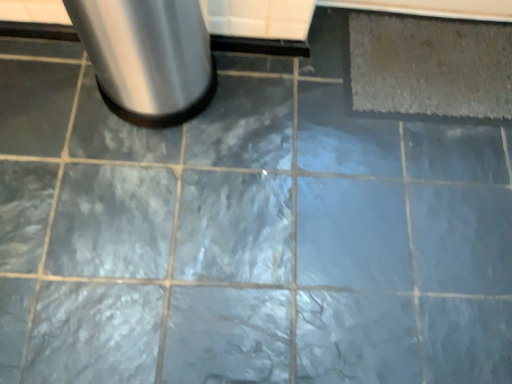
Measure the distance between point (482, 34) and camera.

They are 4.57 feet apart.

What is the approximate height of gray textured mat at upper right?

It is 2.12 centimeters.

Locate an element on the screen. gray textured mat at upper right is located at coordinates (430, 66).

This screenshot has width=512, height=384. What do you see at coordinates (430, 66) in the screenshot? I see `gray textured mat at upper right` at bounding box center [430, 66].

The height and width of the screenshot is (384, 512). What are the coordinates of `brushed metal trash can at upper left` in the screenshot? It's located at (148, 57).

What do you see at coordinates (148, 57) in the screenshot? The width and height of the screenshot is (512, 384). I see `brushed metal trash can at upper left` at bounding box center [148, 57].

Where is `gray textured mat at upper right`? The height and width of the screenshot is (384, 512). gray textured mat at upper right is located at coordinates [x=430, y=66].

Between brushed metal trash can at upper left and gray textured mat at upper right, which one appears on the right side from the viewer's perspective?

Positioned to the right is gray textured mat at upper right.

Is brushed metal trash can at upper left positioned in front of gray textured mat at upper right?

Yes, the depth of brushed metal trash can at upper left is less than that of gray textured mat at upper right.

Considering the positions of point (126, 111) and point (445, 63), is point (126, 111) closer or farther from the camera than point (445, 63)?

Point (126, 111) appears to be closer to the viewer than point (445, 63).

From the image's perspective, is brushed metal trash can at upper left over gray textured mat at upper right?

Actually, brushed metal trash can at upper left appears below gray textured mat at upper right in the image.

From a real-world perspective, which is physically above, brushed metal trash can at upper left or gray textured mat at upper right?

brushed metal trash can at upper left, from a real-world perspective.

Is brushed metal trash can at upper left thinner than gray textured mat at upper right?

Yes, brushed metal trash can at upper left is thinner than gray textured mat at upper right.

Does brushed metal trash can at upper left have a lesser height compared to gray textured mat at upper right?

In fact, brushed metal trash can at upper left may be taller than gray textured mat at upper right.

Which of these two, brushed metal trash can at upper left or gray textured mat at upper right, is smaller?

With smaller size is gray textured mat at upper right.

Would you say gray textured mat at upper right is part of brushed metal trash can at upper left's contents?

No, gray textured mat at upper right is not inside brushed metal trash can at upper left.

Is brushed metal trash can at upper left far away from gray textured mat at upper right?

No, there isn't a large distance between brushed metal trash can at upper left and gray textured mat at upper right.

Could you tell me if brushed metal trash can at upper left is turned towards gray textured mat at upper right?

No, brushed metal trash can at upper left is not aimed at gray textured mat at upper right.

Measure the distance from brushed metal trash can at upper left to gray textured mat at upper right.

They are 25.21 inches apart.

The width and height of the screenshot is (512, 384). In order to click on waste container located in front of the gray textured mat at upper right in this screenshot , I will do `click(148, 57)`.

Between gray textured mat at upper right and brushed metal trash can at upper left, which one appears on the right side from the viewer's perspective?

gray textured mat at upper right is more to the right.

Looking at this image, considering their positions, is gray textured mat at upper right located in front of or behind brushed metal trash can at upper left?

gray textured mat at upper right is behind brushed metal trash can at upper left.

Is point (463, 82) closer to camera compared to point (184, 1)?

No.

From the image's perspective, is gray textured mat at upper right located above or below brushed metal trash can at upper left?

gray textured mat at upper right is above brushed metal trash can at upper left.

From a real-world perspective, between gray textured mat at upper right and brushed metal trash can at upper left, who is vertically lower?

In real-world perspective, gray textured mat at upper right is lower.

Which object is wider, gray textured mat at upper right or brushed metal trash can at upper left?

gray textured mat at upper right is wider.

Does gray textured mat at upper right have a lesser height compared to brushed metal trash can at upper left?

Correct, gray textured mat at upper right is not as tall as brushed metal trash can at upper left.

Is gray textured mat at upper right bigger than brushed metal trash can at upper left?

No, gray textured mat at upper right is not bigger than brushed metal trash can at upper left.

Is gray textured mat at upper right positioned beyond the bounds of brushed metal trash can at upper left?

Yes, gray textured mat at upper right is located beyond the bounds of brushed metal trash can at upper left.

Is gray textured mat at upper right placed right next to brushed metal trash can at upper left?

No, gray textured mat at upper right is not touching brushed metal trash can at upper left.

Is brushed metal trash can at upper left at the back of gray textured mat at upper right?

No, brushed metal trash can at upper left is not at the back of gray textured mat at upper right.

Measure the distance between gray textured mat at upper right and brushed metal trash can at upper left.

gray textured mat at upper right and brushed metal trash can at upper left are 64.04 centimeters apart.

Locate an element on the screen. This screenshot has height=384, width=512. waste container that appears in front of the gray textured mat at upper right is located at coordinates (148, 57).

I want to click on mat above the brushed metal trash can at upper left (from the image's perspective), so click(430, 66).

At what (x,y) coordinates should I click in order to perform the action: click on waste container to the left of gray textured mat at upper right. Please return your answer as a coordinate pair (x, y). This screenshot has height=384, width=512. Looking at the image, I should click on 148,57.